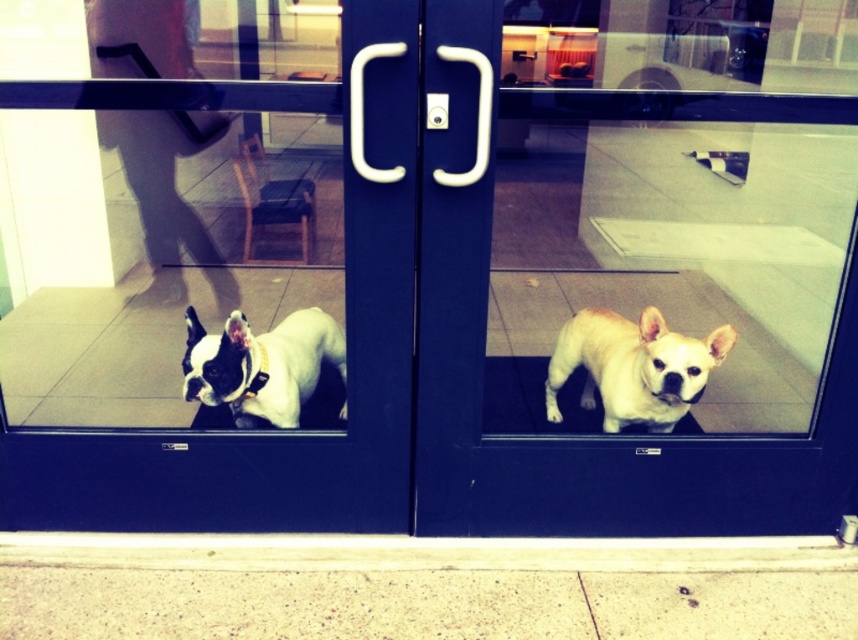
Question: Which of the following is the farthest from the observer?

Choices:
 (A) (656, 416)
 (B) (289, 371)
 (C) (408, 33)
 (D) (438, 324)

Answer: (B)

Question: Does white leather dog at left have a larger size compared to light beige fur at center?

Choices:
 (A) no
 (B) yes

Answer: (B)

Question: Which of the following is the closest to the observer?

Choices:
 (A) white glossy dog at center
 (B) white glossy screen door at left
 (C) white matte dog at left
 (D) white leather dog at left

Answer: (A)

Question: Which object is closer to the camera taking this photo?

Choices:
 (A) white leather dog at left
 (B) white glossy screen door at left

Answer: (B)

Question: Is white glossy screen door at left below light beige fur at center?

Choices:
 (A) yes
 (B) no

Answer: (B)

Question: Is white glossy screen door at left thinner than white matte dog at left?

Choices:
 (A) yes
 (B) no

Answer: (B)